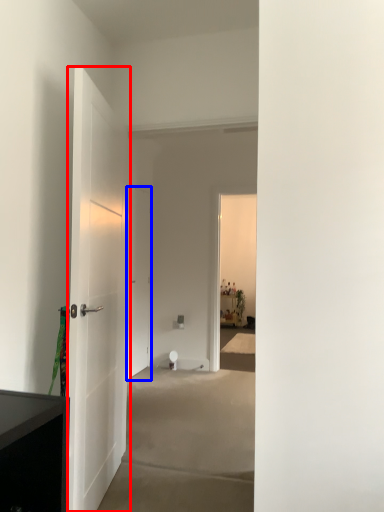
Question: Which of the following is the closest to the observer, door (highlighted by a red box) or door (highlighted by a blue box)?

Choices:
 (A) door
 (B) door

Answer: (A)